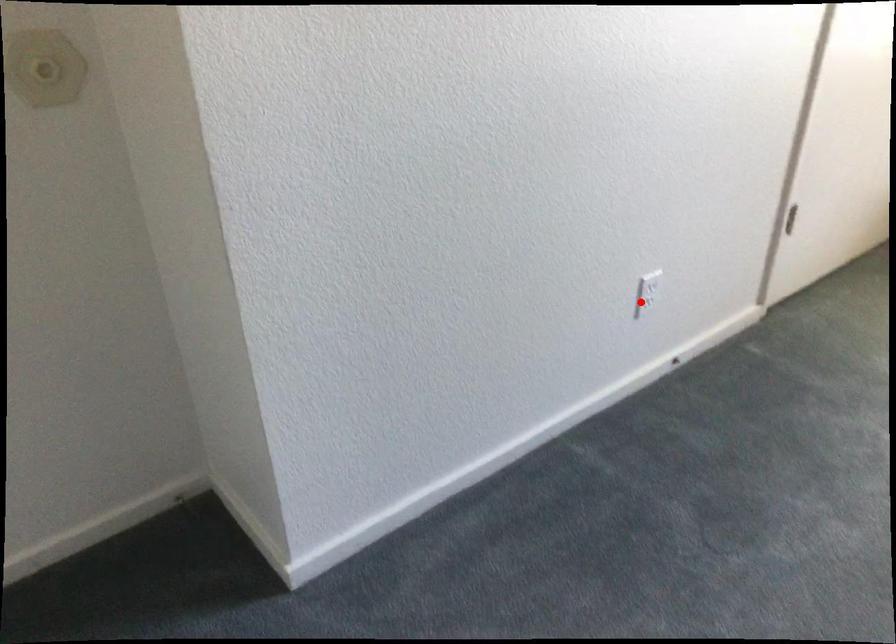
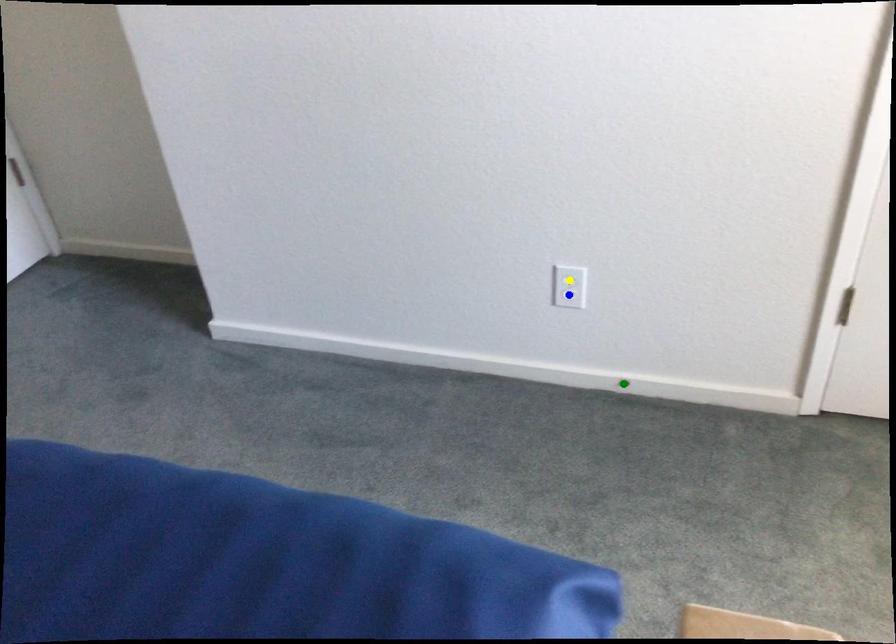
Question: I am providing you with two images of the same scene from different viewpoints. A red point is marked on the first image. You are given multiple points on the second image. In image 2, which mark is for the same physical point as the one in image 1?

Choices:
 (A) blue point
 (B) yellow point
 (C) green point

Answer: (A)